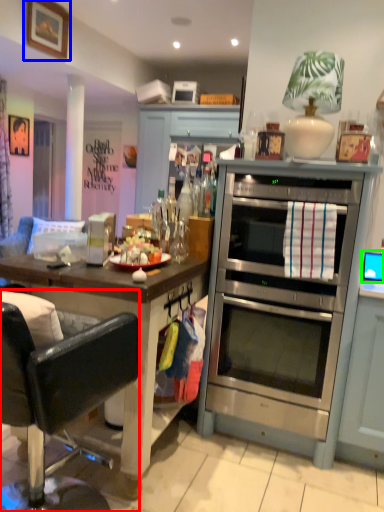
Question: Based on their relative distances, which object is farther from chair (highlighted by a red box)? Choose from picture frame (highlighted by a blue box) and computer monitor (highlighted by a green box).

Choices:
 (A) picture frame
 (B) computer monitor

Answer: (A)